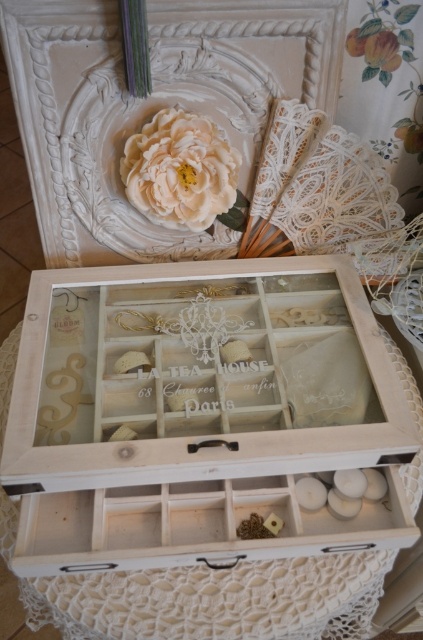
Question: Which object appears farthest from the camera in this image?

Choices:
 (A) creamy matte flower at upper center
 (B) white wood box at center
 (C) white wood drawer at center

Answer: (A)

Question: Does white wood box at center have a greater width compared to white wood drawer at center?

Choices:
 (A) no
 (B) yes

Answer: (B)

Question: Which point is farther from the camera taking this photo?

Choices:
 (A) (231, 227)
 (B) (225, 548)
 (C) (96, 528)

Answer: (A)

Question: Can you confirm if white wood box at center is wider than white wood drawer at center?

Choices:
 (A) no
 (B) yes

Answer: (B)

Question: Among these objects, which one is farthest from the camera?

Choices:
 (A) white wood drawer at center
 (B) white wood box at center
 (C) creamy matte flower at upper center

Answer: (C)

Question: In this image, where is white wood drawer at center located relative to creamy matte flower at upper center?

Choices:
 (A) above
 (B) below

Answer: (B)